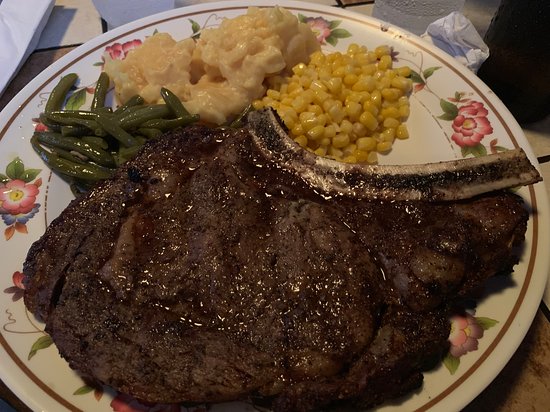
Where is `plate`? The height and width of the screenshot is (412, 550). plate is located at coordinates (476, 312).